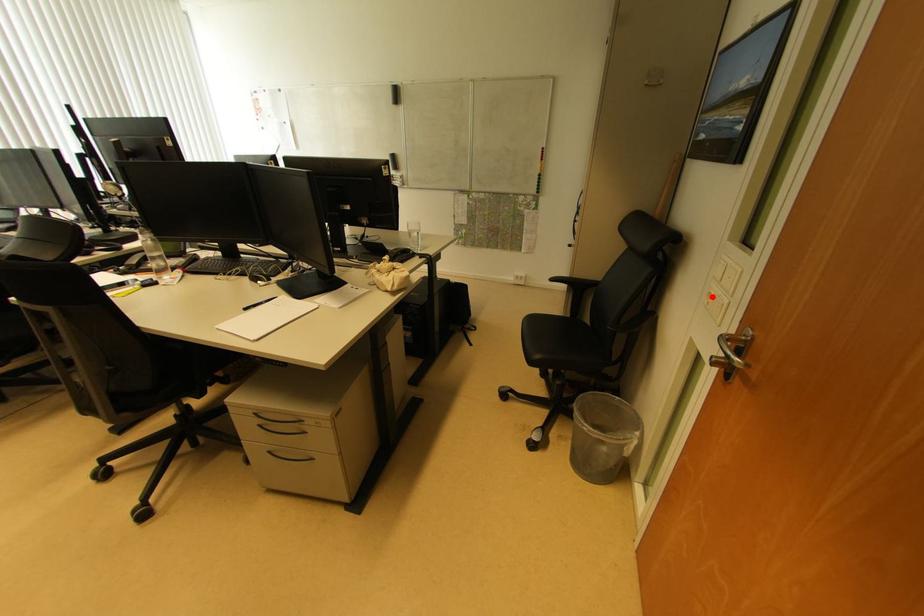
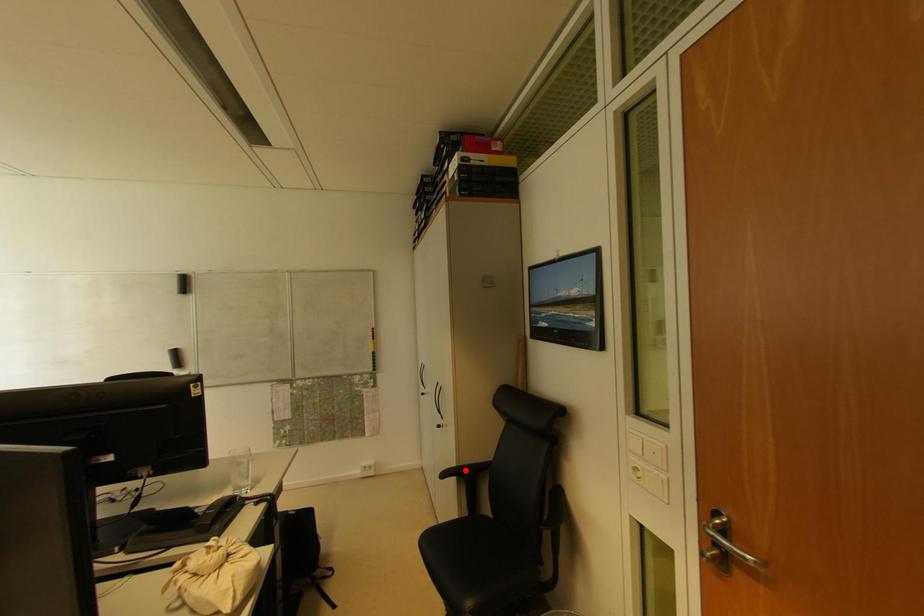
I am providing you with two images of the same scene from different viewpoints. A red point is marked on the first image and another point is marked on the second image. Does the point marked in image1 correspond to the same location as the one in image2?

No